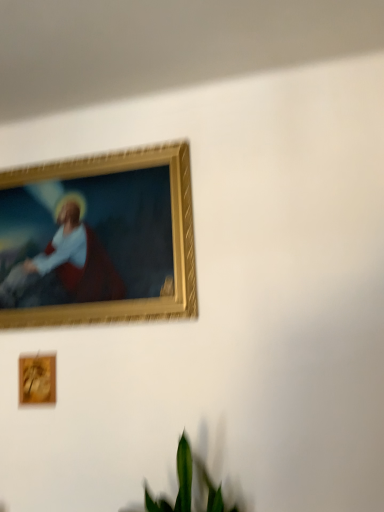
The image size is (384, 512). What do you see at coordinates (188, 487) in the screenshot?
I see `green leafy plant at lower center` at bounding box center [188, 487].

The width and height of the screenshot is (384, 512). I want to click on wooden frame at lower left, which is counted as the first picture frame, starting from the bottom, so click(37, 379).

How different are the orientations of wooden frame at lower left, which is counted as the first picture frame, starting from the bottom, and green leafy plant at lower center in degrees?

There is a 1.3-degree angle between the facing directions of wooden frame at lower left, which is counted as the first picture frame, starting from the bottom, and green leafy plant at lower center.

Is wooden frame at lower left, the 2th picture frame positioned from the top, positioned with its back to green leafy plant at lower center?

No, wooden frame at lower left, the 2th picture frame positioned from the top, is not facing away from green leafy plant at lower center.

Could green leafy plant at lower center be considered to be inside wooden frame at lower left, the 2th picture frame positioned from the top?

That's incorrect, green leafy plant at lower center is not inside wooden frame at lower left, the 2th picture frame positioned from the top.

Considering the sizes of objects wooden frame at lower left, which is counted as the first picture frame, starting from the bottom, and green leafy plant at lower center in the image provided, who is taller, wooden frame at lower left, which is counted as the first picture frame, starting from the bottom, or green leafy plant at lower center?

Standing taller between the two is green leafy plant at lower center.

Which point is more forward, (x=113, y=300) or (x=178, y=487)?

Point (x=178, y=487)

Is green leafy plant at lower center at the back of gold-framed painting at upper left, arranged as the 2th picture frame when ordered from the bottom?

That's not correct — gold-framed painting at upper left, arranged as the 2th picture frame when ordered from the bottom, is not looking away from green leafy plant at lower center.

Locate an element on the screen. houseplant on the right of gold-framed painting at upper left, arranged as the 2th picture frame when ordered from the bottom is located at coordinates (188, 487).

From a real-world perspective, between gold-framed painting at upper left, arranged as the 2th picture frame when ordered from the bottom, and green leafy plant at lower center, who is vertically higher?

In real-world perspective, gold-framed painting at upper left, arranged as the 2th picture frame when ordered from the bottom, is above.

Considering the sizes of objects green leafy plant at lower center and gold-framed painting at upper left, arranged as the 2th picture frame when ordered from the bottom, in the image provided, who is bigger, green leafy plant at lower center or gold-framed painting at upper left, arranged as the 2th picture frame when ordered from the bottom,?

green leafy plant at lower center is bigger.

From the image's perspective, between green leafy plant at lower center and gold-framed painting at upper left, the first picture frame from the top, which one is located above?

gold-framed painting at upper left, the first picture frame from the top, from the image's perspective.

Considering the sizes of objects wooden frame at lower left, the 2th picture frame positioned from the top, and gold-framed painting at upper left, the first picture frame from the top, in the image provided, who is taller, wooden frame at lower left, the 2th picture frame positioned from the top, or gold-framed painting at upper left, the first picture frame from the top,?

With more height is gold-framed painting at upper left, the first picture frame from the top.

From a real-world perspective, is wooden frame at lower left, which is counted as the first picture frame, starting from the bottom, over gold-framed painting at upper left, the first picture frame from the top?

Incorrect, from a real-world perspective, wooden frame at lower left, which is counted as the first picture frame, starting from the bottom, is lower than gold-framed painting at upper left, the first picture frame from the top.

Considering the sizes of objects wooden frame at lower left, the 2th picture frame positioned from the top, and gold-framed painting at upper left, arranged as the 2th picture frame when ordered from the bottom, in the image provided, who is smaller, wooden frame at lower left, the 2th picture frame positioned from the top, or gold-framed painting at upper left, arranged as the 2th picture frame when ordered from the bottom,?

Smaller between the two is wooden frame at lower left, the 2th picture frame positioned from the top.

Is wooden frame at lower left, the 2th picture frame positioned from the top, inside or outside of gold-framed painting at upper left, the first picture frame from the top?

wooden frame at lower left, the 2th picture frame positioned from the top, exists outside the volume of gold-framed painting at upper left, the first picture frame from the top.

Which object is positioned more to the right, gold-framed painting at upper left, the first picture frame from the top, or wooden frame at lower left, the 2th picture frame positioned from the top?

gold-framed painting at upper left, the first picture frame from the top, is more to the right.

Find the location of a particular element. This screenshot has width=384, height=512. picture frame behind the gold-framed painting at upper left, arranged as the 2th picture frame when ordered from the bottom is located at coordinates (x=37, y=379).

Is point (91, 211) closer or farther from the camera than point (38, 366)?

Point (91, 211) is farther from the camera than point (38, 366).

Is green leafy plant at lower center oriented away from wooden frame at lower left, the 2th picture frame positioned from the top?

That's not correct — green leafy plant at lower center is not looking away from wooden frame at lower left, the 2th picture frame positioned from the top.

From the picture: Can we say green leafy plant at lower center lies outside wooden frame at lower left, the 2th picture frame positioned from the top?

Yes, green leafy plant at lower center is located beyond the bounds of wooden frame at lower left, the 2th picture frame positioned from the top.

From a real-world perspective, is green leafy plant at lower center located higher than wooden frame at lower left, the 2th picture frame positioned from the top?

Incorrect, from a real-world perspective, green leafy plant at lower center is lower than wooden frame at lower left, the 2th picture frame positioned from the top.

In the image, there is a wooden frame at lower left, the 2th picture frame positioned from the top. Where is `houseplant below it (from a real-world perspective)`? This screenshot has height=512, width=384. houseplant below it (from a real-world perspective) is located at coordinates (188, 487).

Locate an element on the screen. The height and width of the screenshot is (512, 384). houseplant that is on the right side of gold-framed painting at upper left, the first picture frame from the top is located at coordinates (188, 487).

From the picture: Looking at the image, which one is located closer to gold-framed painting at upper left, the first picture frame from the top, green leafy plant at lower center or wooden frame at lower left, the 2th picture frame positioned from the top?

wooden frame at lower left, the 2th picture frame positioned from the top, lies closer to gold-framed painting at upper left, the first picture frame from the top, than the other object.

When comparing their distances from green leafy plant at lower center, does wooden frame at lower left, which is counted as the first picture frame, starting from the bottom, or gold-framed painting at upper left, the first picture frame from the top, seem further?

gold-framed painting at upper left, the first picture frame from the top.

Based on their spatial positions, is gold-framed painting at upper left, the first picture frame from the top, or green leafy plant at lower center closer to wooden frame at lower left, which is counted as the first picture frame, starting from the bottom?

Among the two, gold-framed painting at upper left, the first picture frame from the top, is located nearer to wooden frame at lower left, which is counted as the first picture frame, starting from the bottom.

Which object lies nearer to the anchor point green leafy plant at lower center, gold-framed painting at upper left, the first picture frame from the top, or wooden frame at lower left, which is counted as the first picture frame, starting from the bottom?

Based on the image, wooden frame at lower left, which is counted as the first picture frame, starting from the bottom, appears to be nearer to green leafy plant at lower center.

Considering their positions, is green leafy plant at lower center positioned further to wooden frame at lower left, the 2th picture frame positioned from the top, than gold-framed painting at upper left, arranged as the 2th picture frame when ordered from the bottom?

green leafy plant at lower center is further to wooden frame at lower left, the 2th picture frame positioned from the top.

Estimate the real-world distances between objects in this image. Which object is further from gold-framed painting at upper left, arranged as the 2th picture frame when ordered from the bottom, wooden frame at lower left, which is counted as the first picture frame, starting from the bottom, or green leafy plant at lower center?

Based on the image, green leafy plant at lower center appears to be further to gold-framed painting at upper left, arranged as the 2th picture frame when ordered from the bottom.

You are a GUI agent. You are given a task and a screenshot of the screen. Output one action in this format:
    pyautogui.click(x=<x>, y=<y>)
    Task: Click on the picture frame between gold-framed painting at upper left, arranged as the 2th picture frame when ordered from the bottom, and green leafy plant at lower center, in the vertical direction
    
    Given the screenshot: What is the action you would take?
    pyautogui.click(x=37, y=379)